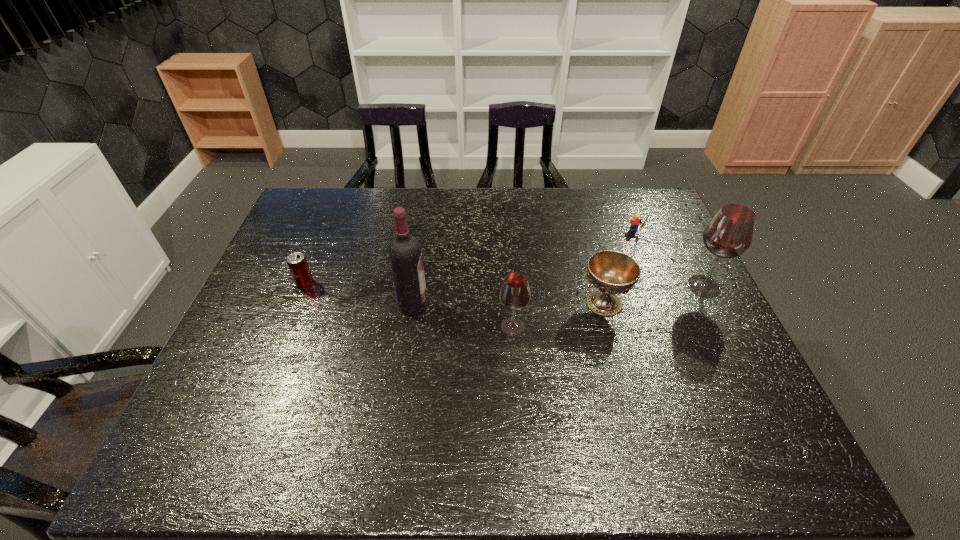
This screenshot has height=540, width=960. In the image, there is a desktop. In order to click on vacant space at the far edge in this screenshot , I will do `click(537, 196)`.

At what (x,y) coordinates should I click in order to perform the action: click on vacant area at the near edge. Please return your answer as a coordinate pair (x, y). The image size is (960, 540). Looking at the image, I should click on (333, 399).

Where is `vacant region at the left edge of the desktop`? The width and height of the screenshot is (960, 540). vacant region at the left edge of the desktop is located at coordinates (275, 330).

This screenshot has width=960, height=540. Find the location of `vacant space at the right edge`. vacant space at the right edge is located at coordinates (662, 230).

Where is `vacant space at the far left corner`? vacant space at the far left corner is located at coordinates (323, 202).

In the image, there is a desktop. Where is `vacant space at the far right corner`? The height and width of the screenshot is (540, 960). vacant space at the far right corner is located at coordinates (641, 199).

The width and height of the screenshot is (960, 540). In order to click on vacant space that is in between the right wineglass and the third object from right to left in this screenshot , I will do `click(654, 294)`.

Where is `vacant space in between the third object from right to left and the shorter wineglass`? vacant space in between the third object from right to left and the shorter wineglass is located at coordinates (559, 315).

Locate an element on the screen. free spot between the farthest object and the taller wineglass is located at coordinates (669, 260).

Where is `empty location between the fifth object from left to right and the right wineglass`? The image size is (960, 540). empty location between the fifth object from left to right and the right wineglass is located at coordinates (669, 260).